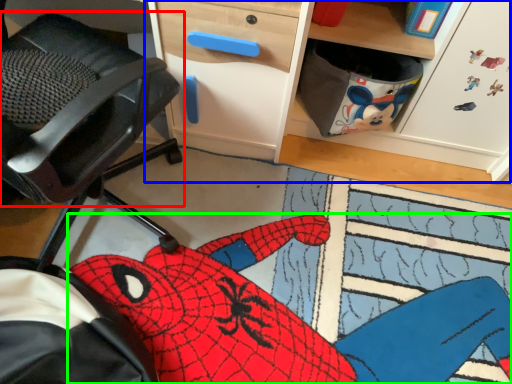
Question: Which object is positioned closest to chair (highlighted by a red box)? Select from computer desk (highlighted by a blue box) and animal (highlighted by a green box).

Choices:
 (A) computer desk
 (B) animal

Answer: (A)